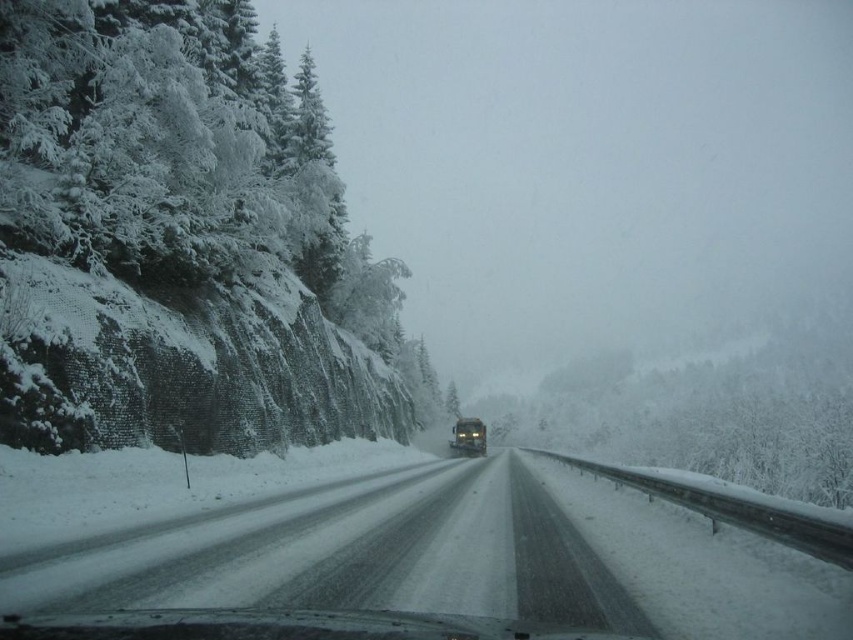
Can you confirm if snowy asphalt road at center is thinner than matte black bus at center?

In fact, snowy asphalt road at center might be wider than matte black bus at center.

Can you confirm if snowy asphalt road at center is shorter than matte black bus at center?

Yes, snowy asphalt road at center is shorter than matte black bus at center.

The width and height of the screenshot is (853, 640). In order to click on snowy asphalt road at center in this screenshot , I will do `click(445, 557)`.

At what (x,y) coordinates should I click in order to perform the action: click on snowy asphalt road at center. Please return your answer as a coordinate pair (x, y). The image size is (853, 640). Looking at the image, I should click on (445, 557).

Does white frosty trees at left have a smaller size compared to matte black bus at center?

No.

Is point (7, 214) positioned after point (479, 454)?

No, (7, 214) is in front of (479, 454).

Where is `white frosty trees at left`? This screenshot has height=640, width=853. white frosty trees at left is located at coordinates (183, 241).

Which is above, white frosty trees at left or snowy asphalt road at center?

white frosty trees at left is above.

Between point (239, 419) and point (155, 605), which one is positioned in front?

Point (155, 605) is in front.

Is point (315, 90) farther from viewer compared to point (677, 508)?

Yes, it is.

At what (x,y) coordinates should I click in order to perform the action: click on white frosty trees at left. Please return your answer as a coordinate pair (x, y). Looking at the image, I should click on (183, 241).